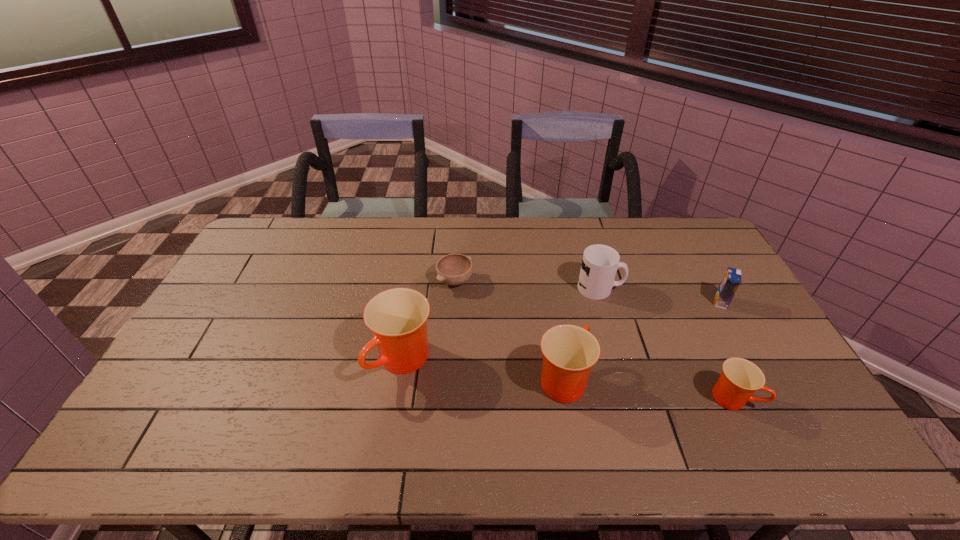
With all cups evenly spaced, where should an extra cup be placed on the left to continue the pattern? Please point out a vacant space. Please provide its 2D coordinates. Your answer should be formatted as a tuple, i.e. [(x, y)], where the tuple contains the x and y coordinates of a point satisfying the conditions above.

[(255, 345)]